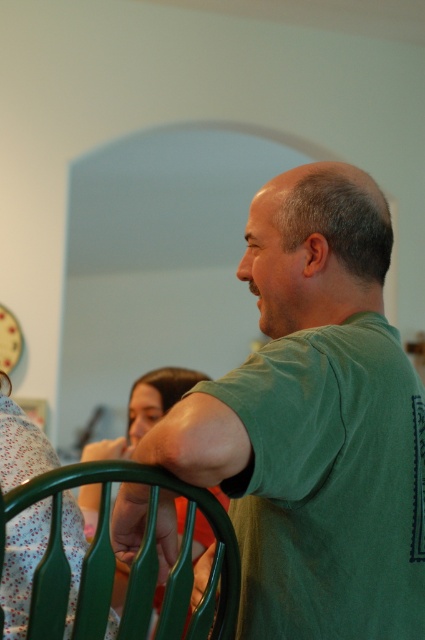
You are a photographer setting up a shoot in this scene. You need to position a light source to the left of the green matte shirt at center and to the right of the matte green chair at lower left. Is this possible based on their positions?

The green matte shirt at center is to the right of the matte green chair at lower left, so placing a light source to the left of the green matte shirt at center and to the right of the matte green chair at lower left is possible as they are positioned in a way that allows for such placement between them.

You are organizing a photoshoot and need to position a model near the matte green chair at lower left. Based on the scene, where should you place the model relative to the matte floral dress at lower left to ensure they are both in frame?

The matte floral dress at lower left is to the left of the matte green chair at lower left. To keep both in frame, position the model to the right of the matte floral dress at lower left so they align with the chair.